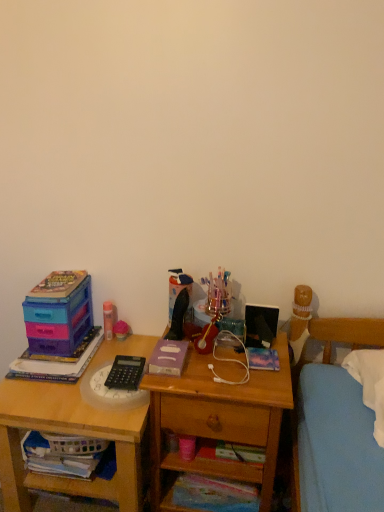
At what (x,y) coordinates should I click in order to perform the action: click on vacant space in front of pink matte glue stick at upper left, arranged as the second stationery when viewed from the right. Please return your answer as a coordinate pair (x, y). Looking at the image, I should click on (x=88, y=354).